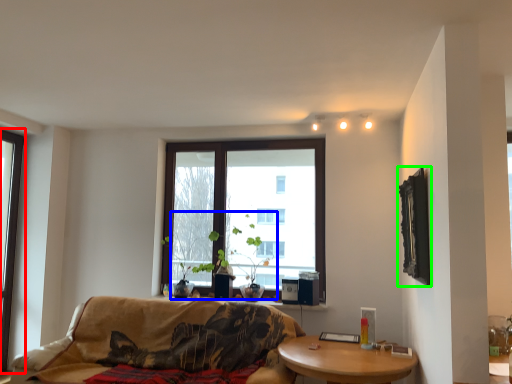
Question: Which object is positioned closest to window (highlighted by a red box)? Select from plant (highlighted by a blue box) and picture frame (highlighted by a green box).

Choices:
 (A) plant
 (B) picture frame

Answer: (A)